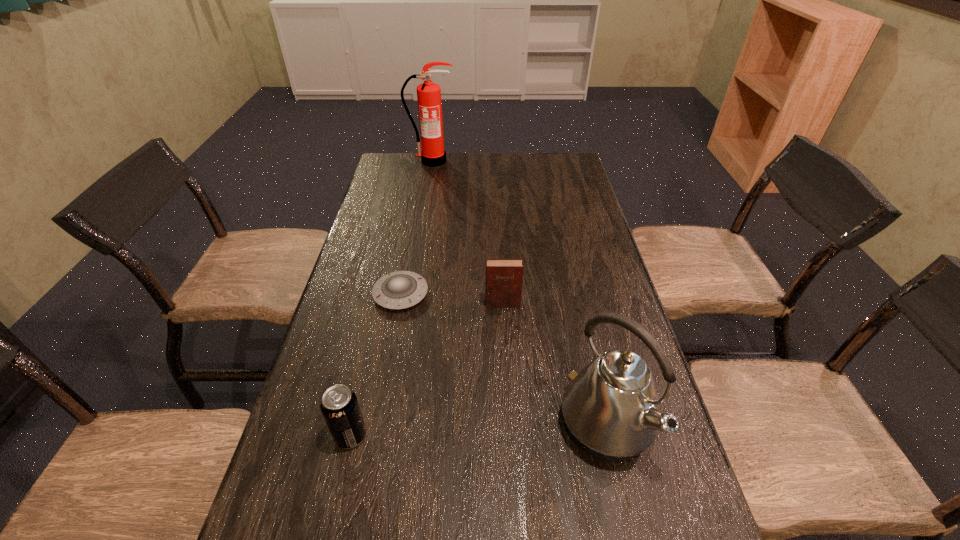
This screenshot has width=960, height=540. What are the coordinates of `fire extinguisher` in the screenshot? It's located at (433, 154).

Identify the location of the tallest object. (433, 154).

Find the location of a particular element. The height and width of the screenshot is (540, 960). the fourth shortest object is located at coordinates (611, 409).

This screenshot has height=540, width=960. In order to click on the rightmost object in this screenshot , I will do `click(611, 409)`.

I want to click on diary, so (503, 288).

What are the coordinates of `soda can` in the screenshot? It's located at (340, 408).

Identify the location of the shortest object. (397, 290).

This screenshot has width=960, height=540. What are the coordinates of `free location located with the nozzle aimed from the fire extinguisher` in the screenshot? It's located at (429, 178).

At what (x,y) coordinates should I click in order to perform the action: click on vacant space located 0.330m on the back of the kettle. Please return your answer as a coordinate pair (x, y). Image resolution: width=960 pixels, height=540 pixels. Looking at the image, I should click on (573, 284).

Identify the location of vacant space located on the front cover of the fourth object from left to right. (509, 413).